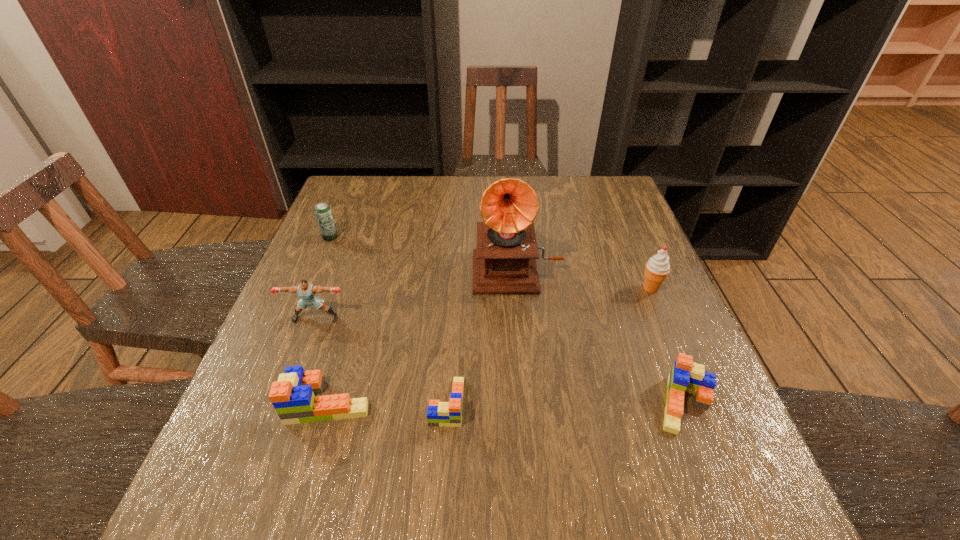
The height and width of the screenshot is (540, 960). Find the location of `free spot between the puncher and the second shortest object`. free spot between the puncher and the second shortest object is located at coordinates (500, 361).

Locate an element on the screen. The image size is (960, 540). empty space that is in between the leftmost Lego and the puncher is located at coordinates (322, 360).

Where is `vacant area that lies between the puncher and the farthest object`? The image size is (960, 540). vacant area that lies between the puncher and the farthest object is located at coordinates (323, 278).

Locate an element on the screen. The height and width of the screenshot is (540, 960). free point between the tallest object and the icecream is located at coordinates (584, 278).

At what (x,y) coordinates should I click in order to perform the action: click on free space between the second tallest Lego and the icecream. Please return your answer as a coordinate pair (x, y). Looking at the image, I should click on (668, 346).

Identify the location of free spot between the icecream and the fifth object from left to right. Image resolution: width=960 pixels, height=540 pixels. (584, 278).

At what (x,y) coordinates should I click in order to perform the action: click on blank region between the tallest Lego and the sixth tallest object. Please return your answer as a coordinate pair (x, y). Image resolution: width=960 pixels, height=540 pixels. Looking at the image, I should click on click(x=507, y=403).

The width and height of the screenshot is (960, 540). I want to click on vacant region between the tallest Lego and the puncher, so click(322, 360).

Image resolution: width=960 pixels, height=540 pixels. I want to click on empty space between the farthest object and the third object from right to left, so click(423, 253).

Identify which object is the fourth nearest to the tallest Lego. Please provide its 2D coordinates. Your answer should be formatted as a tuple, i.e. [(x, y)], where the tuple contains the x and y coordinates of a point satisfying the conditions above.

[(323, 213)]